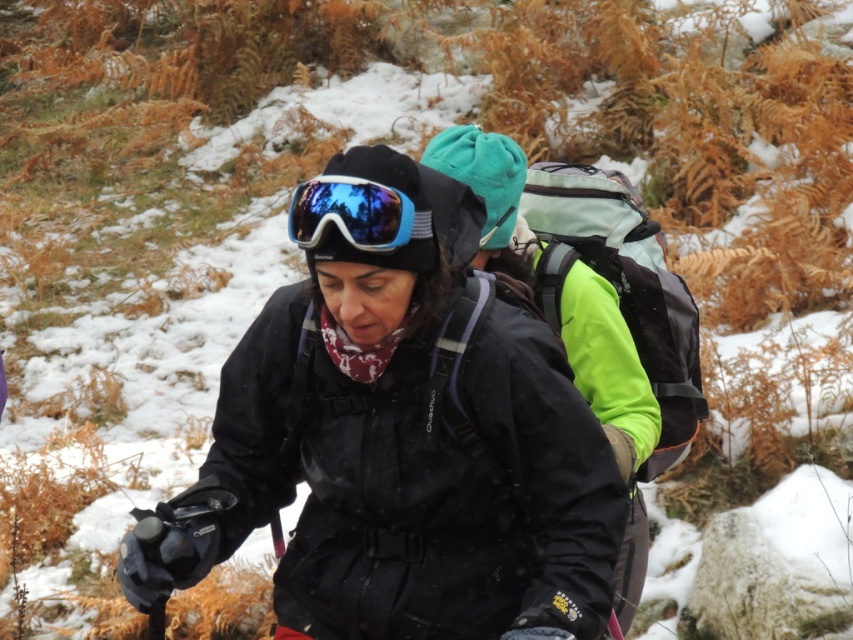
Between matte black jacket at center and shiny blue ski goggles at center, which one is positioned lower?

matte black jacket at center

Is point (401, 497) in front of point (289, 218)?

No.

The image size is (853, 640). What are the coordinates of `matte black jacket at center` in the screenshot? It's located at (402, 449).

At what (x,y) coordinates should I click in order to perform the action: click on matte black jacket at center. Please return your answer as a coordinate pair (x, y). The height and width of the screenshot is (640, 853). Looking at the image, I should click on (402, 449).